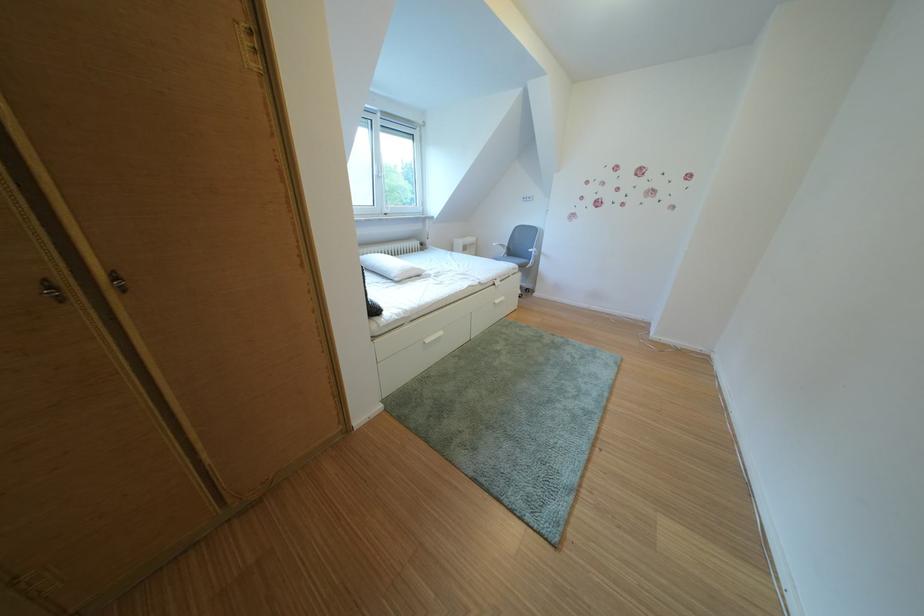
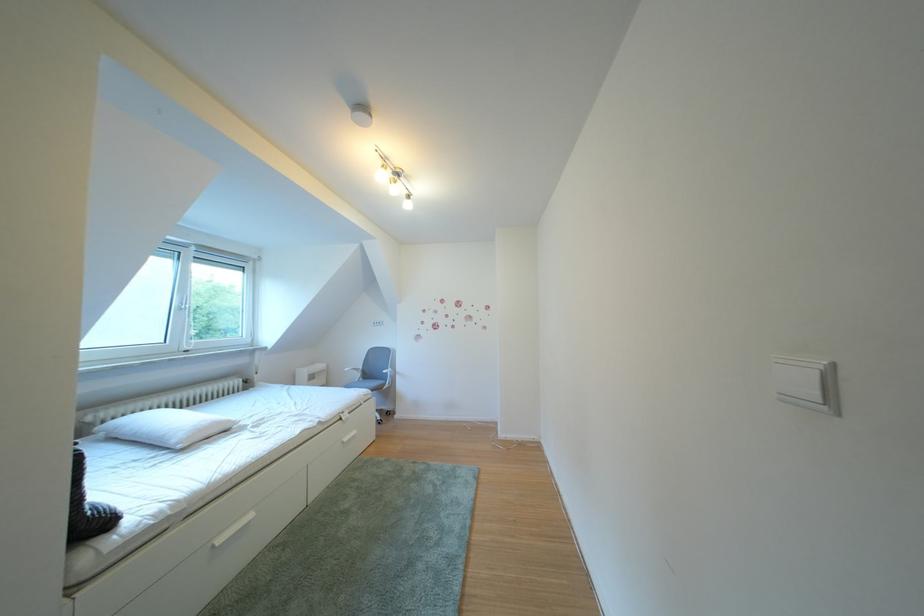
Find the pixel in the second image that matches pixel 525 262 in the first image.

(381, 387)